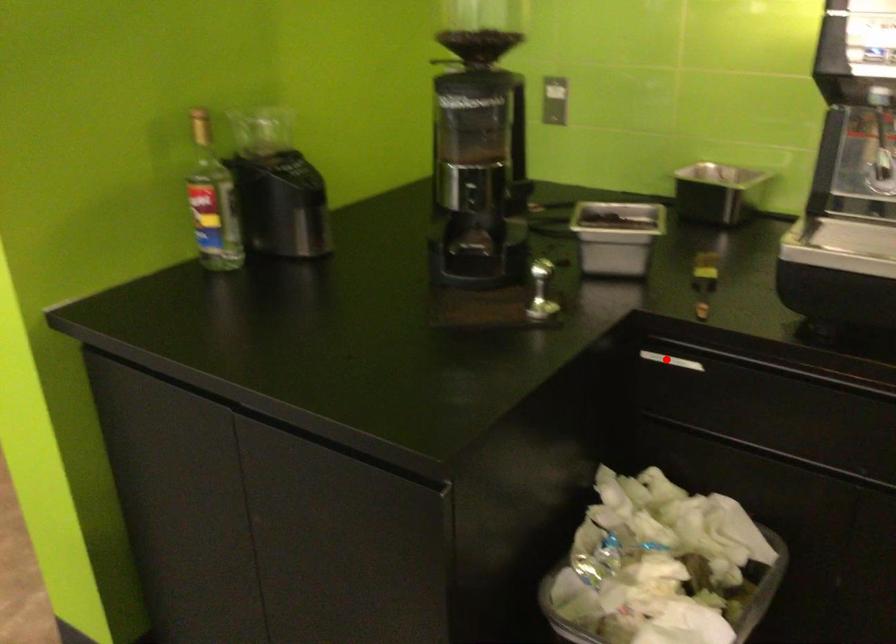
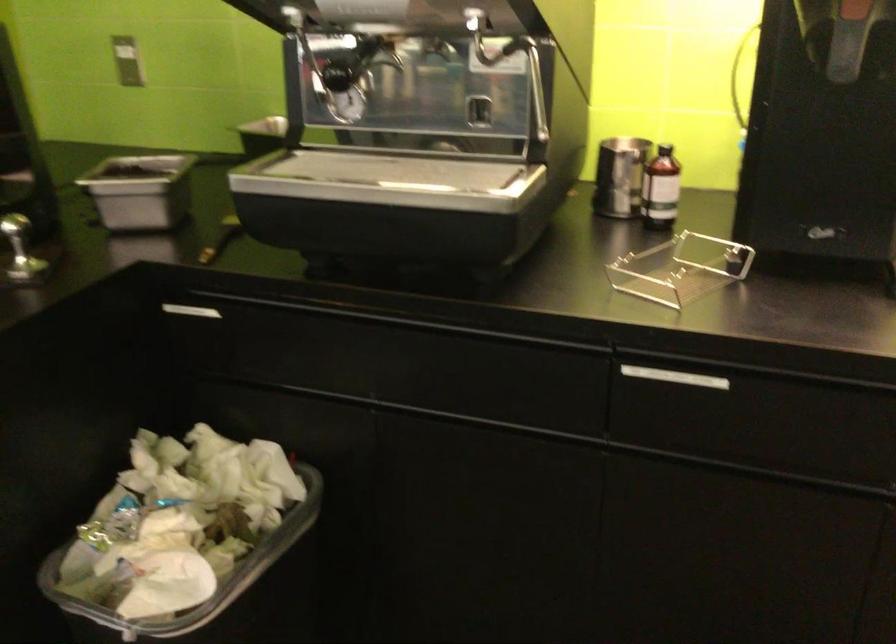
Find the pixel in the second image that matches the highlighted location in the first image.

(192, 310)